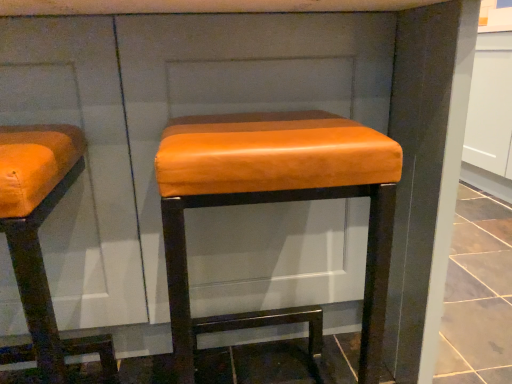
Image resolution: width=512 pixels, height=384 pixels. Describe the element at coordinates (275, 202) in the screenshot. I see `matte orange leather stool at center` at that location.

What is the approximate width of matte orange leather stool at center?

The width of matte orange leather stool at center is 15.35 inches.

Locate an element on the screen. Image resolution: width=512 pixels, height=384 pixels. matte orange leather stool at center is located at coordinates (275, 202).

Describe the element at coordinates (38, 239) in the screenshot. This screenshot has height=384, width=512. I see `orange leather stool at left` at that location.

Image resolution: width=512 pixels, height=384 pixels. Find the location of `orange leather stool at left`. orange leather stool at left is located at coordinates (38, 239).

Measure the distance between orange leather stool at left and camera.

orange leather stool at left is 19.90 inches away from camera.

You are a GUI agent. You are given a task and a screenshot of the screen. Output one action in this format:
    pyautogui.click(x=<x>, y=<y>)
    Task: Click on the matte orange leather stool at center
    The image size is (512, 384).
    Given the screenshot: What is the action you would take?
    pyautogui.click(x=275, y=202)

Visually, is orange leather stool at left positioned to the left or to the right of matte orange leather stool at center?

Based on their positions, orange leather stool at left is located to the left of matte orange leather stool at center.

Is orange leather stool at left in front of or behind matte orange leather stool at center in the image?

orange leather stool at left is positioned closer to the viewer than matte orange leather stool at center.

Does point (14, 261) come in front of point (259, 167)?

No.

From the image's perspective, between orange leather stool at left and matte orange leather stool at center, which one is located above?

From the image's view, matte orange leather stool at center is above.

From a real-world perspective, between orange leather stool at left and matte orange leather stool at center, who is vertically higher?

From a 3D spatial view, orange leather stool at left is above.

Considering the relative sizes of orange leather stool at left and matte orange leather stool at center in the image provided, is orange leather stool at left thinner than matte orange leather stool at center?

Yes.

In the scene shown: Can you confirm if orange leather stool at left is taller than matte orange leather stool at center?

No.

Which of these two, orange leather stool at left or matte orange leather stool at center, is bigger?

matte orange leather stool at center.

Choose the correct answer: Is orange leather stool at left inside matte orange leather stool at center or outside it?

orange leather stool at left is not inside matte orange leather stool at center, it's outside.

Are orange leather stool at left and matte orange leather stool at center far apart?

Actually, orange leather stool at left and matte orange leather stool at center are a little close together.

Is orange leather stool at left aimed at matte orange leather stool at center?

No.

Image resolution: width=512 pixels, height=384 pixels. In order to click on furniture that appears on the left of matte orange leather stool at center in this screenshot , I will do `click(38, 239)`.

In the image, is matte orange leather stool at center on the left side or the right side of orange leather stool at left?

From the image, it's evident that matte orange leather stool at center is to the right of orange leather stool at left.

Considering the positions of objects matte orange leather stool at center and orange leather stool at left in the image provided, who is behind, matte orange leather stool at center or orange leather stool at left?

matte orange leather stool at center is behind.

Which point is more distant from viewer, (185,372) or (59,379)?

The point (59,379) is behind.

From the image's perspective, is matte orange leather stool at center below orange leather stool at left?

Actually, matte orange leather stool at center appears above orange leather stool at left in the image.

From a real-world perspective, who is located lower, matte orange leather stool at center or orange leather stool at left?

matte orange leather stool at center is physically lower.

Is matte orange leather stool at center thinner than orange leather stool at left?

No, matte orange leather stool at center is not thinner than orange leather stool at left.

Does matte orange leather stool at center have a greater height compared to orange leather stool at left?

Indeed, matte orange leather stool at center has a greater height compared to orange leather stool at left.

Is matte orange leather stool at center smaller than orange leather stool at left?

Actually, matte orange leather stool at center might be larger than orange leather stool at left.

Is matte orange leather stool at center not within orange leather stool at left?

Yes, matte orange leather stool at center is located beyond the bounds of orange leather stool at left.

Is matte orange leather stool at center placed right next to orange leather stool at left?

They are not placed beside each other.

Looking at this image, is matte orange leather stool at center facing towards orange leather stool at left?

No, matte orange leather stool at center is not oriented towards orange leather stool at left.

What's the angular difference between matte orange leather stool at center and orange leather stool at left's facing directions?

2.26 degrees separate the facing orientations of matte orange leather stool at center and orange leather stool at left.

Identify the location of stool behind the orange leather stool at left. The width and height of the screenshot is (512, 384). (275, 202).

Where is `stool to the right of orange leather stool at left`? The width and height of the screenshot is (512, 384). stool to the right of orange leather stool at left is located at coordinates (275, 202).

Find the location of `stool behind the orange leather stool at left`. stool behind the orange leather stool at left is located at coordinates (275, 202).